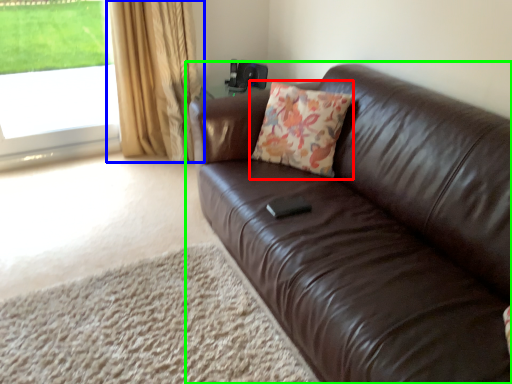
Question: Which object is positioned farthest from throw pillow (highlighted by a red box)? Select from curtain (highlighted by a blue box) and studio couch (highlighted by a green box).

Choices:
 (A) curtain
 (B) studio couch

Answer: (A)